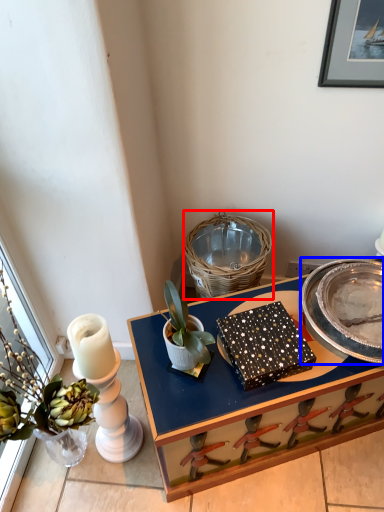
Question: Among these objects, which one is nearest to the camera, basket (highlighted by a red box) or plate (highlighted by a blue box)?

Choices:
 (A) basket
 (B) plate

Answer: (B)